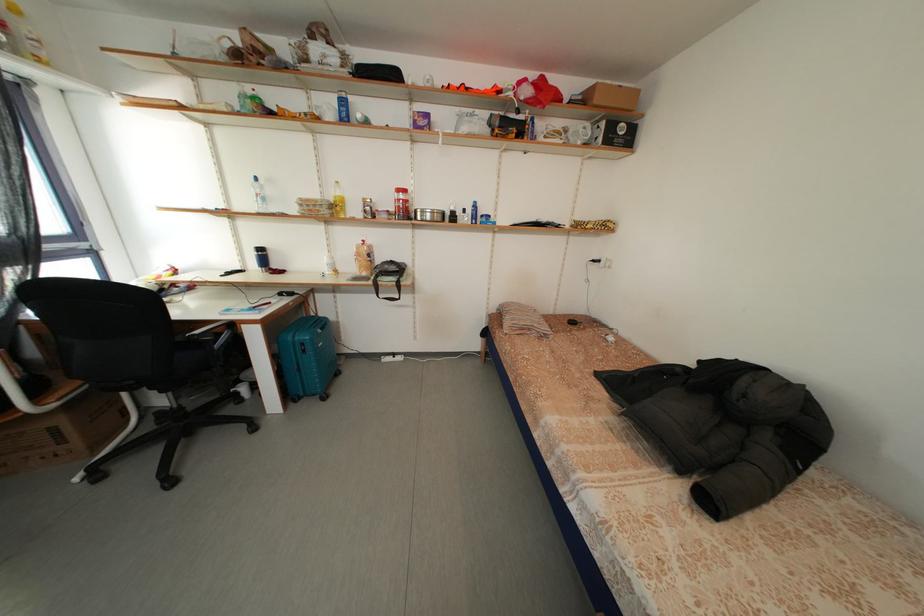
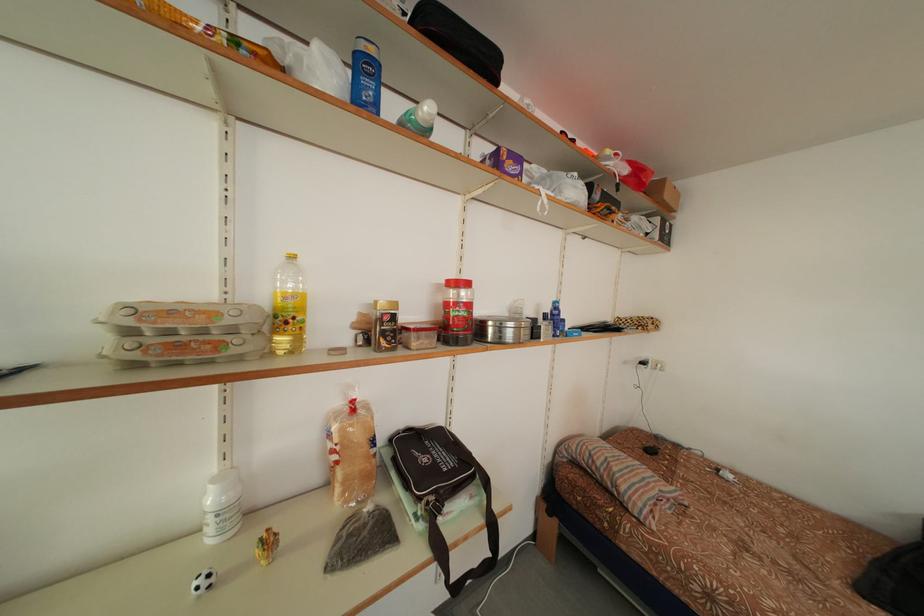
Where in the second image is the point corresponding to the point at 315,206 from the first image?

(178, 317)